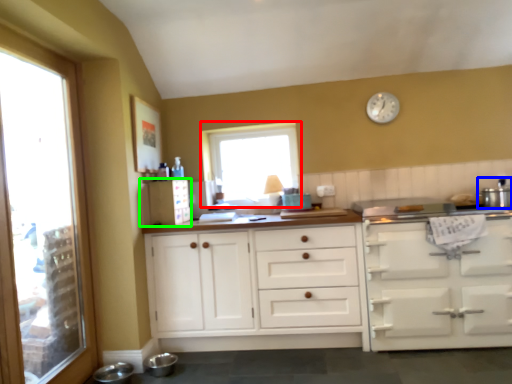
Question: Based on their relative distances, which object is nearer to window (highlighted by a red box)? Choose from appliance (highlighted by a blue box) and appliance (highlighted by a green box).

Choices:
 (A) appliance
 (B) appliance

Answer: (B)